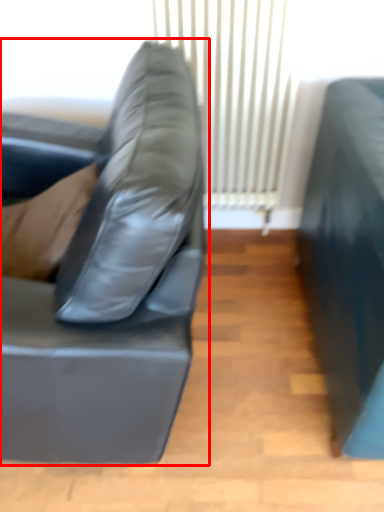
Question: Where is studio couch (annotated by the red box) located in relation to curtain in the image?

Choices:
 (A) right
 (B) left

Answer: (B)